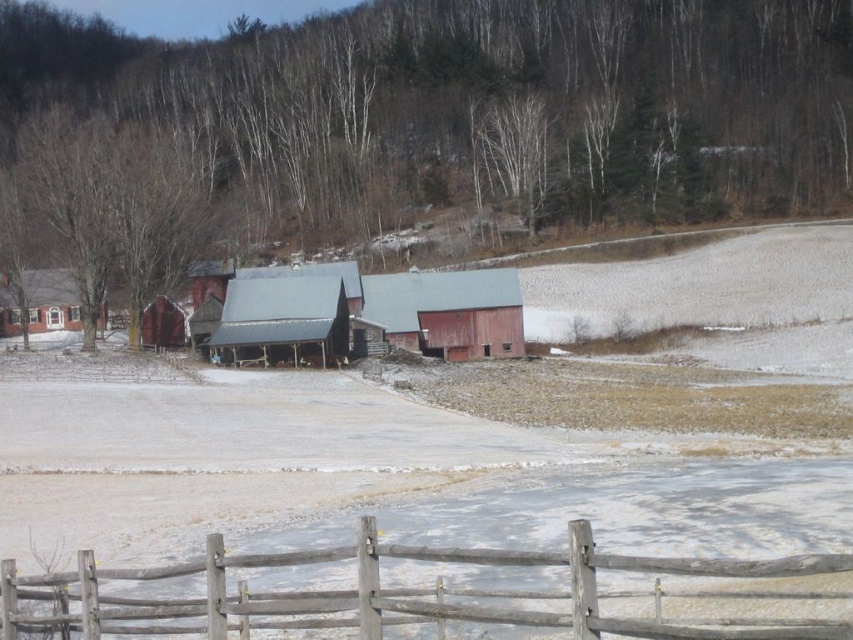
Which is more to the left, rustic wooden barn at center or brick house at left?

From the viewer's perspective, brick house at left appears more on the left side.

Between rustic wooden barn at center and brick house at left, which one has more height?

rustic wooden barn at center

Is point (415, 291) more distant than point (7, 296)?

Yes, point (415, 291) is farther from viewer.

At what (x,y) coordinates should I click in order to perform the action: click on rustic wooden barn at center. Please return your answer as a coordinate pair (x, y). This screenshot has width=853, height=640. Looking at the image, I should click on (448, 310).

Can you confirm if weathered wood fence at lower center is positioned to the left of rustic wooden barn at center?

No, weathered wood fence at lower center is not to the left of rustic wooden barn at center.

Does weathered wood fence at lower center appear over rustic wooden barn at center?

Incorrect, weathered wood fence at lower center is not positioned above rustic wooden barn at center.

Where is `weathered wood fence at lower center`? weathered wood fence at lower center is located at coordinates (405, 593).

At what (x,y) coordinates should I click in order to perform the action: click on weathered wood fence at lower center. Please return your answer as a coordinate pair (x, y). This screenshot has height=640, width=853. Looking at the image, I should click on (405, 593).

Between weathered wood fence at lower center and brick house at left, which one has less height?

weathered wood fence at lower center

Is point (602, 621) more distant than point (61, 280)?

No, it is not.

Between point (157, 616) and point (51, 294), which one is positioned behind?

The point (51, 294) is more distant.

Find the location of a particular element. weathered wood fence at lower center is located at coordinates (405, 593).